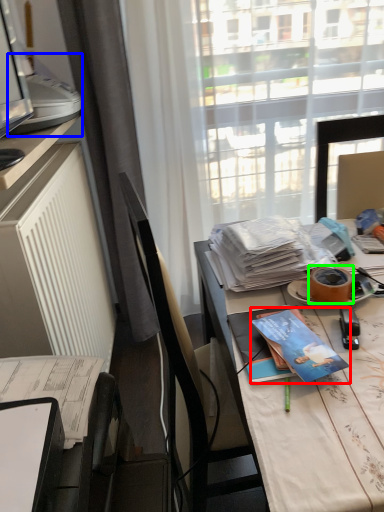
Question: Estimate the real-world distances between objects in this image. Which object is closer to book (highlighted by a red box), printer (highlighted by a blue box) or adhesive tape (highlighted by a green box)?

Choices:
 (A) printer
 (B) adhesive tape

Answer: (B)